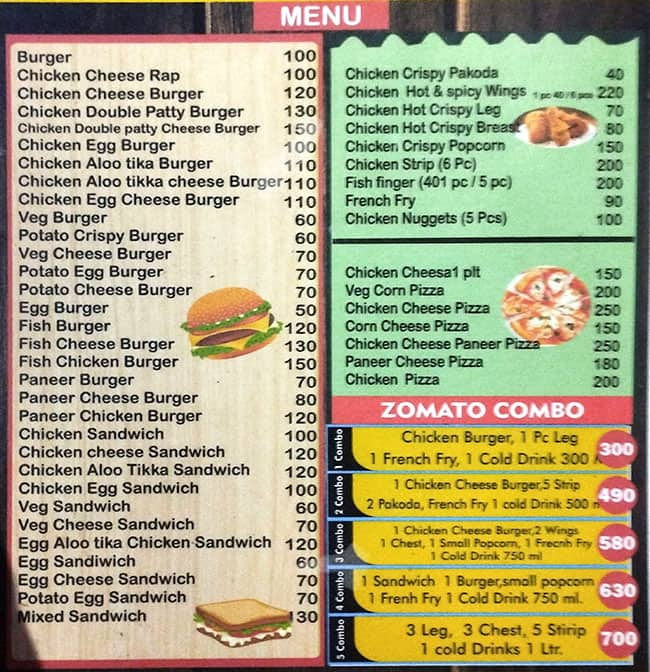
I want to click on shadow in the corner, so click(x=13, y=655).